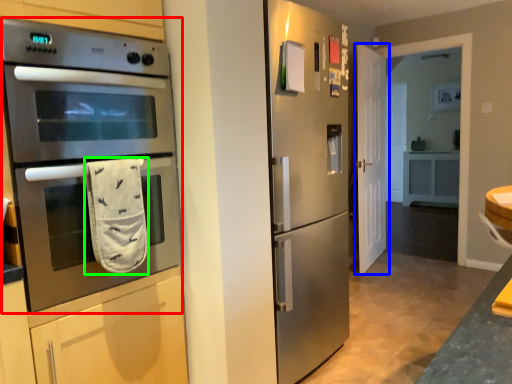
Question: Based on their relative distances, which object is farther from microwave oven (highlighted by a red box)? Choose from door (highlighted by a blue box) and hand towel (highlighted by a green box).

Choices:
 (A) door
 (B) hand towel

Answer: (A)